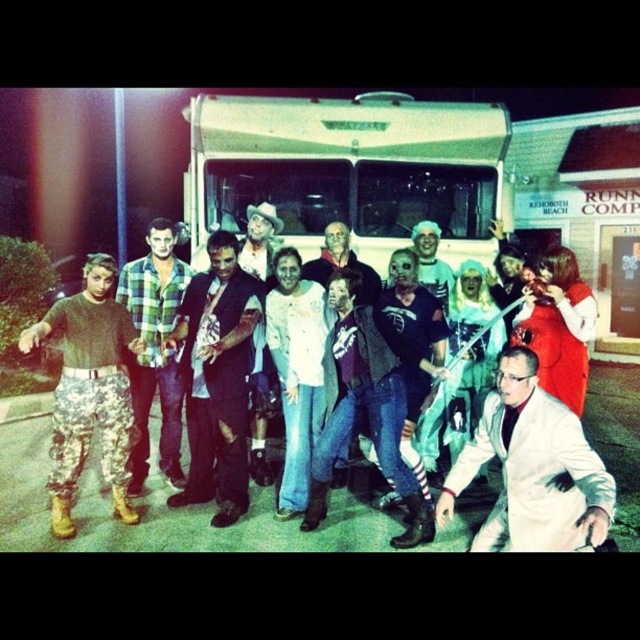
Question: Among these objects, which one is farthest from the camera?

Choices:
 (A) white matte lab coat at lower right
 (B) camouflage pants at left
 (C) ripped denim jeans at center
 (D) white shirt at center

Answer: (D)

Question: Can you confirm if ripped jeans at center is positioned below matte black hat at center?

Choices:
 (A) no
 (B) yes

Answer: (A)

Question: Estimate the real-world distances between objects in this image. Which object is farther from the ripped jeans at center?

Choices:
 (A) white shirt at center
 (B) camouflage pants at left
 (C) ripped denim jeans at center

Answer: (A)

Question: Is white matte lab coat at lower right to the left of white shirt at center from the viewer's perspective?

Choices:
 (A) yes
 (B) no

Answer: (B)

Question: Estimate the real-world distances between objects in this image. Which object is farther from the white matte shirt at center?

Choices:
 (A) matte black hat at center
 (B) green plaid shirt at center

Answer: (B)

Question: Is white matte lab coat at lower right above camouflage pants at left?

Choices:
 (A) no
 (B) yes

Answer: (A)